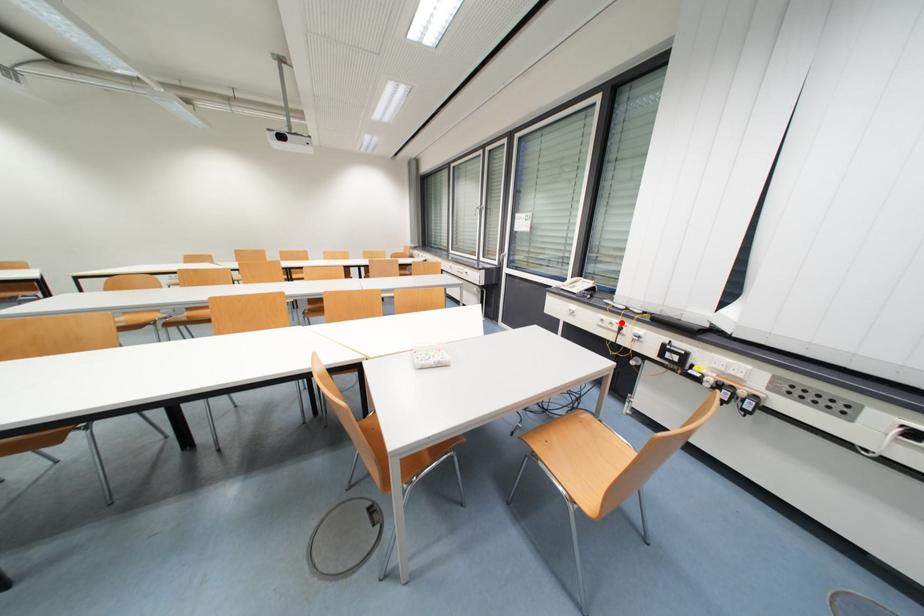
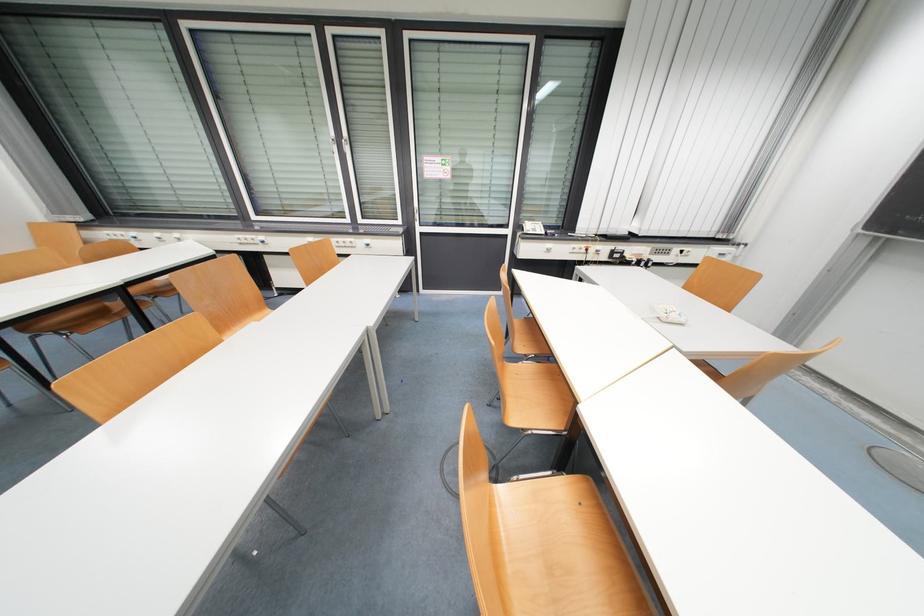
Where in the second image is the point corresponding to the highlighted location from the first image?

(589, 246)